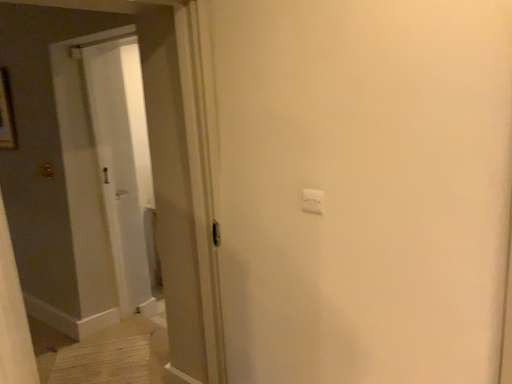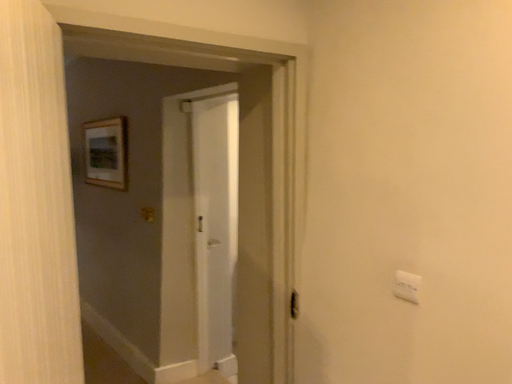
Question: Which way did the camera rotate in the video?

Choices:
 (A) rotated upward
 (B) rotated downward

Answer: (A)